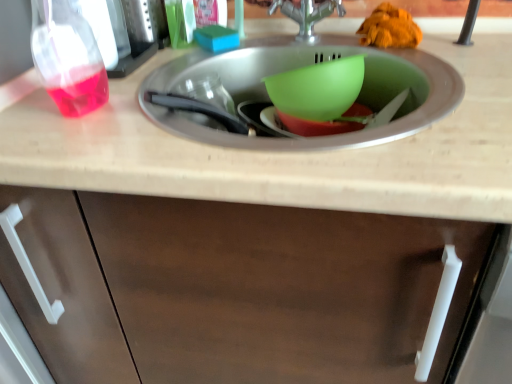
Locate an element on the screen. free point to the left of transparent plastic bottle at left is located at coordinates (31, 109).